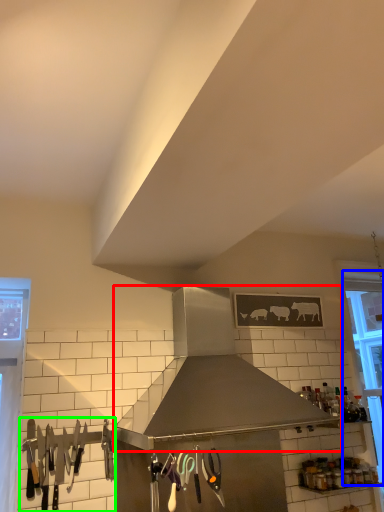
Question: Based on their relative distances, which object is farther from kitchen appliance (highlighted by a red box)? Choose from window (highlighted by a blue box) and silverware (highlighted by a green box).

Choices:
 (A) window
 (B) silverware

Answer: (A)